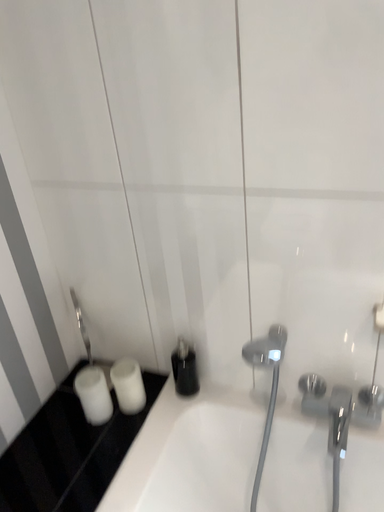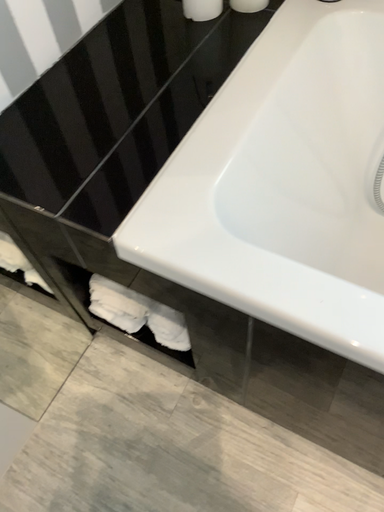
Question: Which way did the camera rotate in the video?

Choices:
 (A) rotated downward
 (B) rotated upward

Answer: (A)